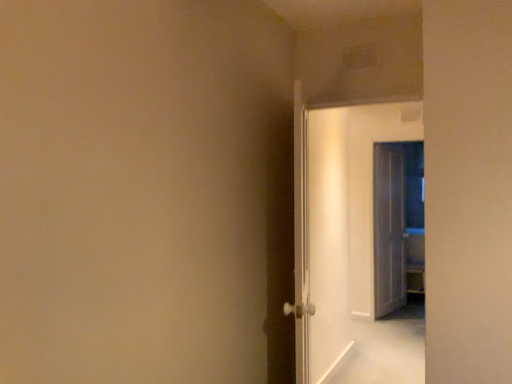
Question: In terms of size, does white glossy door at center, the third door viewed from the right, appear bigger or smaller than translucent glass door at right, the 3th door positioned from the front?

Choices:
 (A) big
 (B) small

Answer: (A)

Question: From the image's perspective, is white glossy door at center, which is counted as the 1th door, starting from the left, located above or below translucent glass door at right, the 3th door positioned from the front?

Choices:
 (A) above
 (B) below

Answer: (A)

Question: Based on their relative distances, which object is nearer to the translucent glass door at right, the 3th door positioned from the front?

Choices:
 (A) white glossy door at center, the third door viewed from the right
 (B) white glossy door at center, acting as the 2th door starting from the left

Answer: (B)

Question: Which object is positioned farthest from the white glossy door at center, which appears as the second door when viewed from the back?

Choices:
 (A) translucent glass door at right, the 3th door positioned from the front
 (B) white glossy door at center, placed as the first door when sorted from front to back

Answer: (A)